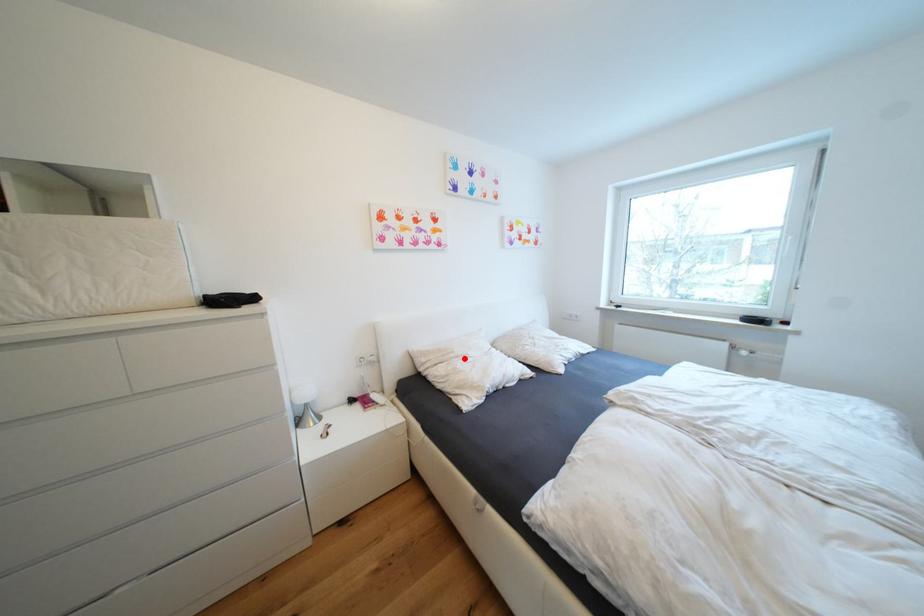
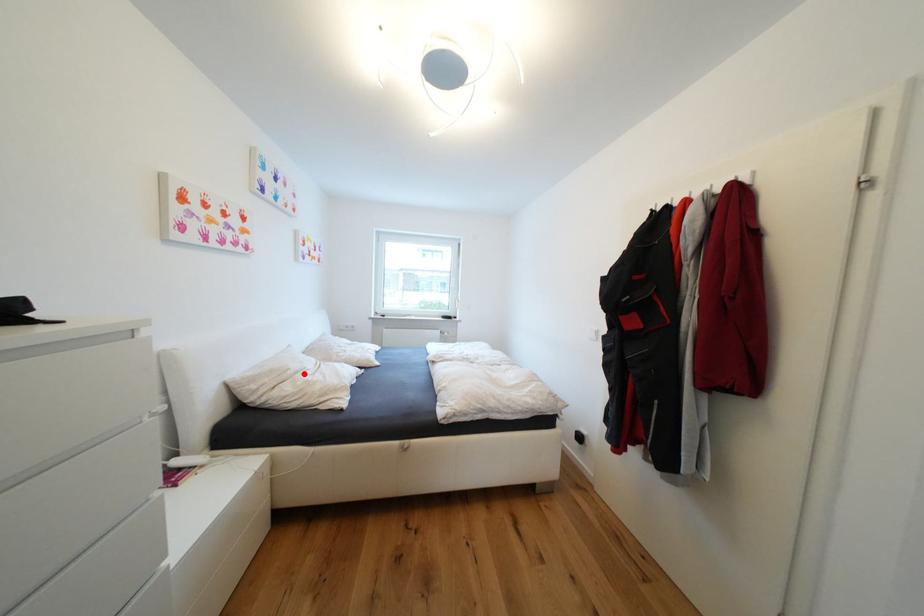
I am providing you with two images of the same scene from different viewpoints. A red point is marked on the first image and another point is marked on the second image. Does the point marked in image1 correspond to the same location as the one in image2?

Yes